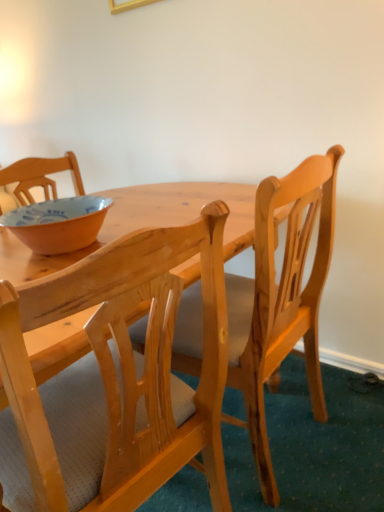
Question: Is point (84, 502) closer or farther from the camera than point (6, 226)?

Choices:
 (A) farther
 (B) closer

Answer: (B)

Question: From the image's perspective, is natural wood chair at center, the 1th chair in the left-to-right sequence, located above or below matte orange bowl at left?

Choices:
 (A) below
 (B) above

Answer: (A)

Question: Which object is positioned farthest from the natural wood chair at center, the 1th chair in the left-to-right sequence?

Choices:
 (A) natural wood chair at center, marked as the first chair in a right-to-left arrangement
 (B) matte orange bowl at left

Answer: (B)

Question: Estimate the real-world distances between objects in this image. Which object is farther from the natural wood chair at center, which is the second chair in right-to-left order?

Choices:
 (A) matte orange bowl at left
 (B) natural wood chair at center, marked as the first chair in a right-to-left arrangement

Answer: (A)